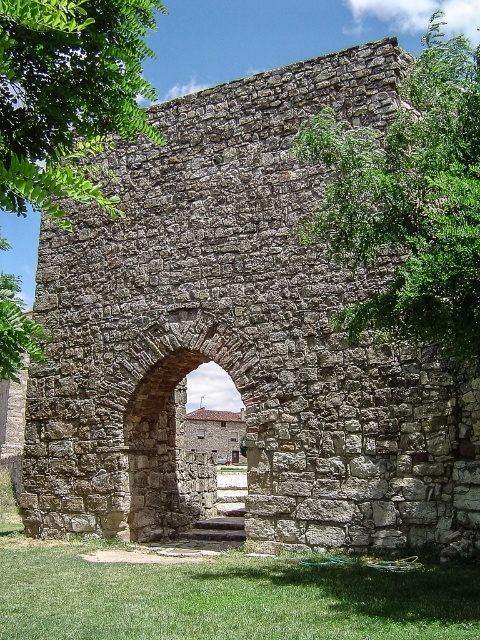
Between green grass at lower center and green leafy tree at upper right, which one is positioned higher?

green leafy tree at upper right

Is green grass at lower center closer to the viewer compared to green leafy tree at upper right?

Yes, green grass at lower center is in front of green leafy tree at upper right.

Who is more forward, (324, 602) or (472, 305)?

Positioned in front is point (472, 305).

The width and height of the screenshot is (480, 640). Identify the location of green grass at lower center. (228, 596).

Does green grass at lower center appear under rustic stone archway at center?

Yes.

Who is higher up, green grass at lower center or rustic stone archway at center?

Positioned higher is rustic stone archway at center.

Which is behind, point (46, 611) or point (139, 451)?

Positioned behind is point (139, 451).

Where is `green grass at lower center`? The image size is (480, 640). green grass at lower center is located at coordinates (228, 596).

Based on the photo, who is lower down, green leafy tree at upper right or green leafy tree at upper left?

green leafy tree at upper left is below.

Does green leafy tree at upper right have a lesser height compared to green leafy tree at upper left?

In fact, green leafy tree at upper right may be taller than green leafy tree at upper left.

Which is in front, point (358, 198) or point (21, 26)?

Point (21, 26)

Where is `green leafy tree at upper right`? The height and width of the screenshot is (640, 480). green leafy tree at upper right is located at coordinates (409, 200).